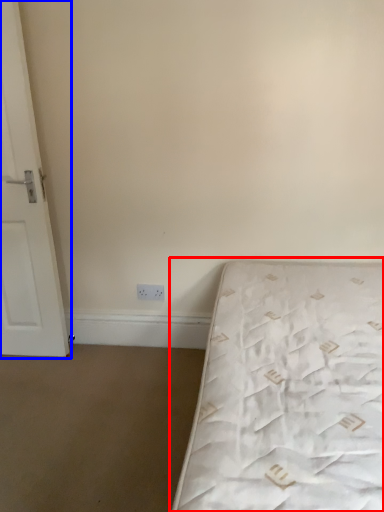
Question: Which object appears closest to the camera in this image, bed (highlighted by a red box) or door (highlighted by a blue box)?

Choices:
 (A) bed
 (B) door

Answer: (A)